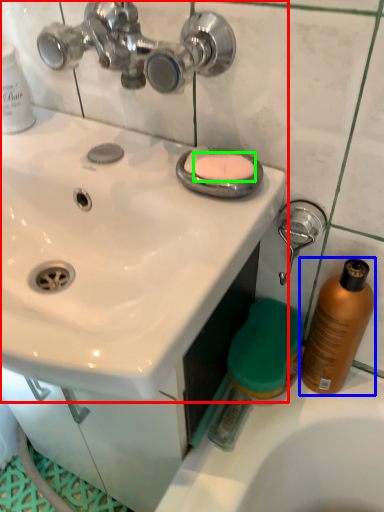
Question: Which is farther away from sink (highlighted by a red box)? cleaning product (highlighted by a blue box) or soap (highlighted by a green box)?

Choices:
 (A) cleaning product
 (B) soap

Answer: (A)